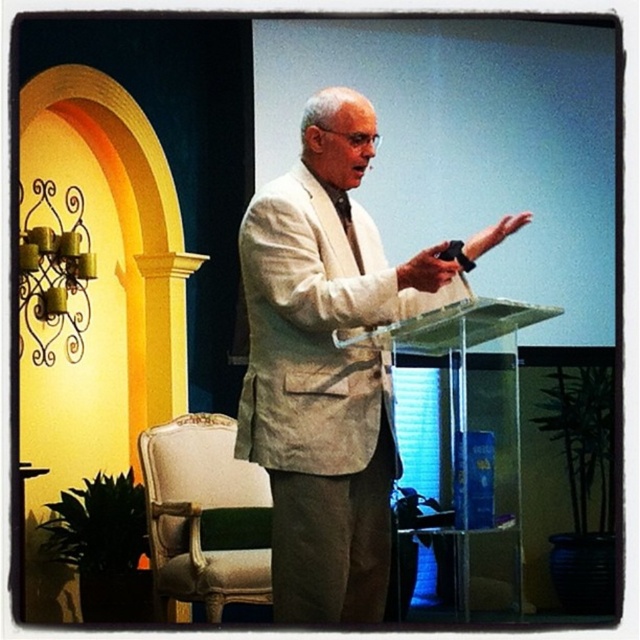
Question: Which object is the farthest from the transparent acrylic podium at center?

Choices:
 (A) light beige fabric armchair at lower left
 (B) white textured suit at center

Answer: (A)

Question: Can you confirm if light beige fabric armchair at lower left is positioned to the left of transparent acrylic podium at center?

Choices:
 (A) no
 (B) yes

Answer: (B)

Question: Estimate the real-world distances between objects in this image. Which object is closer to the white textured suit at center?

Choices:
 (A) light beige fabric armchair at lower left
 (B) transparent acrylic podium at center

Answer: (B)

Question: Estimate the real-world distances between objects in this image. Which object is closer to the light beige fabric armchair at lower left?

Choices:
 (A) transparent acrylic podium at center
 (B) white textured suit at center

Answer: (A)

Question: Considering the relative positions of light beige fabric armchair at lower left and transparent acrylic podium at center in the image provided, where is light beige fabric armchair at lower left located with respect to transparent acrylic podium at center?

Choices:
 (A) below
 (B) above

Answer: (A)

Question: Is light beige fabric armchair at lower left further to camera compared to transparent acrylic podium at center?

Choices:
 (A) yes
 (B) no

Answer: (A)